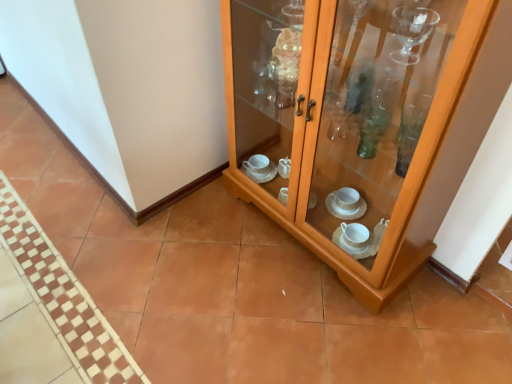
The width and height of the screenshot is (512, 384). Find the location of `space that is in front of wooden cabinet at center`. space that is in front of wooden cabinet at center is located at coordinates (320, 322).